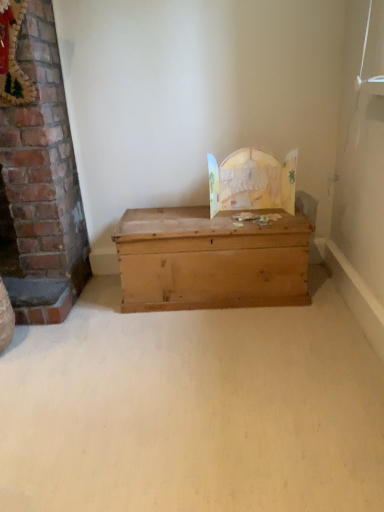
The height and width of the screenshot is (512, 384). I want to click on unoccupied area in front of natural wood trunk at center, so click(x=223, y=354).